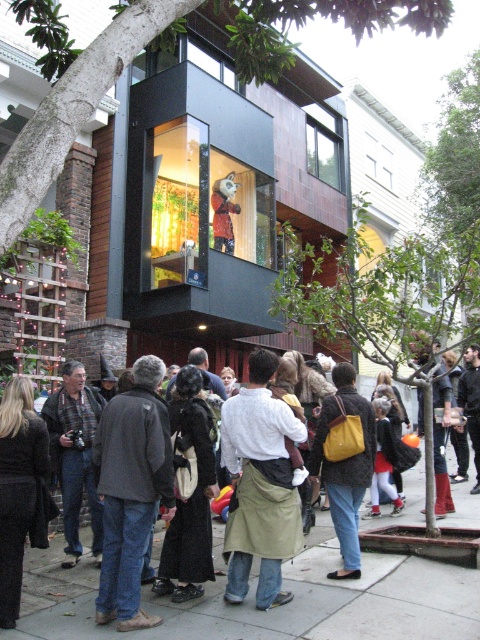
Question: Which of these objects is positioned farthest from the dark gray jacket at center?

Choices:
 (A) matte yellow backpack at center
 (B) concrete sidewalk at center
 (C) khaki fabric apron at center

Answer: (A)

Question: Considering the relative positions of concrete sidewalk at center and khaki fabric apron at center in the image provided, where is concrete sidewalk at center located with respect to khaki fabric apron at center?

Choices:
 (A) above
 (B) below

Answer: (B)

Question: Is concrete sidewalk at center above matte yellow backpack at center?

Choices:
 (A) no
 (B) yes

Answer: (A)

Question: Which point is farther to the camera?

Choices:
 (A) khaki fabric apron at center
 (B) concrete sidewalk at center
 (C) dark gray jacket at center
 (D) matte yellow backpack at center

Answer: (D)

Question: Which object is farther from the camera taking this photo?

Choices:
 (A) matte yellow backpack at center
 (B) khaki fabric apron at center

Answer: (A)

Question: Is khaki fabric apron at center wider than matte yellow backpack at center?

Choices:
 (A) yes
 (B) no

Answer: (A)